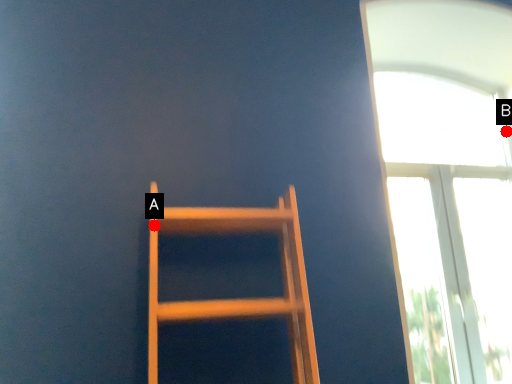
Question: Two points are circled on the image, labeled by A and B beside each circle. Which point is closer to the camera?

Choices:
 (A) A is closer
 (B) B is closer

Answer: (A)